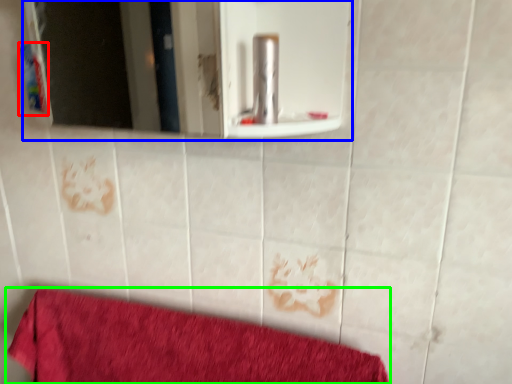
Question: Considering the real-world distances, which object is farthest from toiletry (highlighted by a red box)? mirror (highlighted by a blue box) or towel (highlighted by a green box)?

Choices:
 (A) mirror
 (B) towel

Answer: (A)